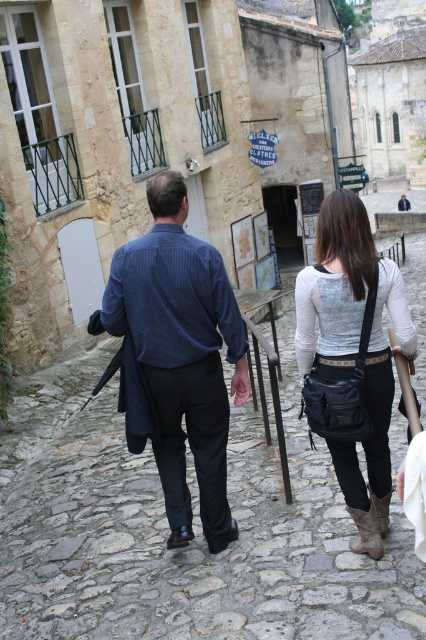
Identify the location of dark blue shirt at center. This screenshot has height=640, width=426. (176, 356).

Does dark blue shirt at center appear under blue striped shirt at center?

Correct, dark blue shirt at center is located below blue striped shirt at center.

Is point (186, 346) in front of point (166, 333)?

No.

You are a GUI agent. You are given a task and a screenshot of the screen. Output one action in this format:
    pyautogui.click(x=<x>, y=<y>)
    Task: Click on the dark blue shirt at center
    The width and height of the screenshot is (426, 640).
    Given the screenshot: What is the action you would take?
    pyautogui.click(x=176, y=356)

Does blue striped shirt at center have a lesser height compared to matte black bag at center?

Correct, blue striped shirt at center is not as tall as matte black bag at center.

The height and width of the screenshot is (640, 426). I want to click on blue striped shirt at center, so click(181, 355).

Does dark blue shirt at center have a lesser width compared to matte black bag at center?

Yes.

Is point (143, 400) farther from camera compared to point (371, 371)?

Yes, point (143, 400) is behind point (371, 371).

Where is `dark blue shirt at center`? dark blue shirt at center is located at coordinates (176, 356).